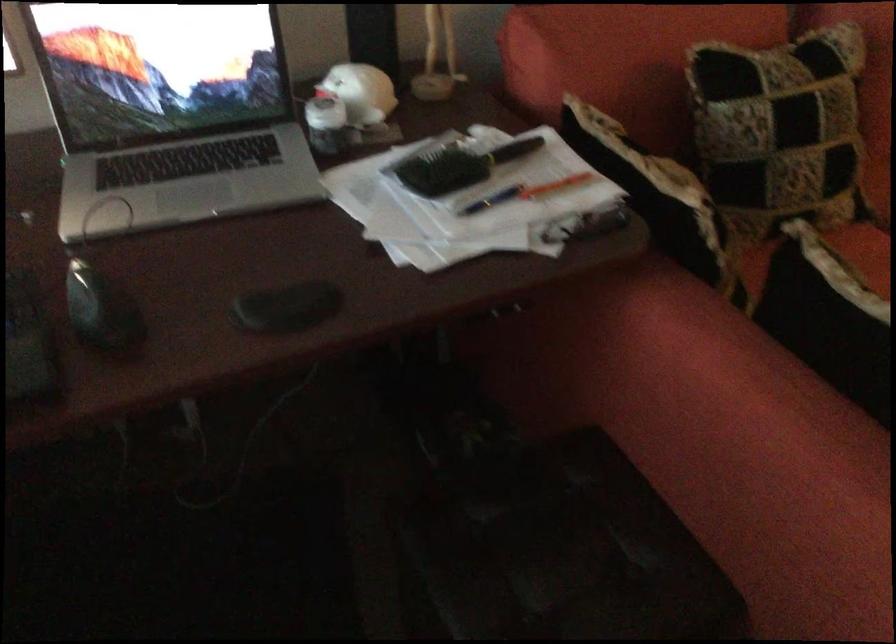
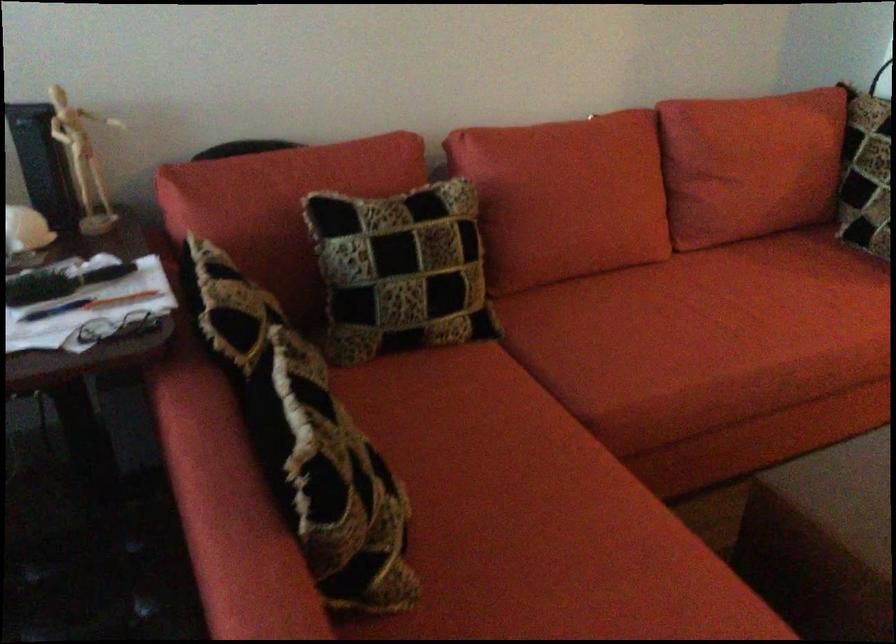
Question: In a continuous first-person perspective shot, in which direction is the camera moving?

Choices:
 (A) Left
 (B) Right
 (C) Forward
 (D) Backward

Answer: (B)